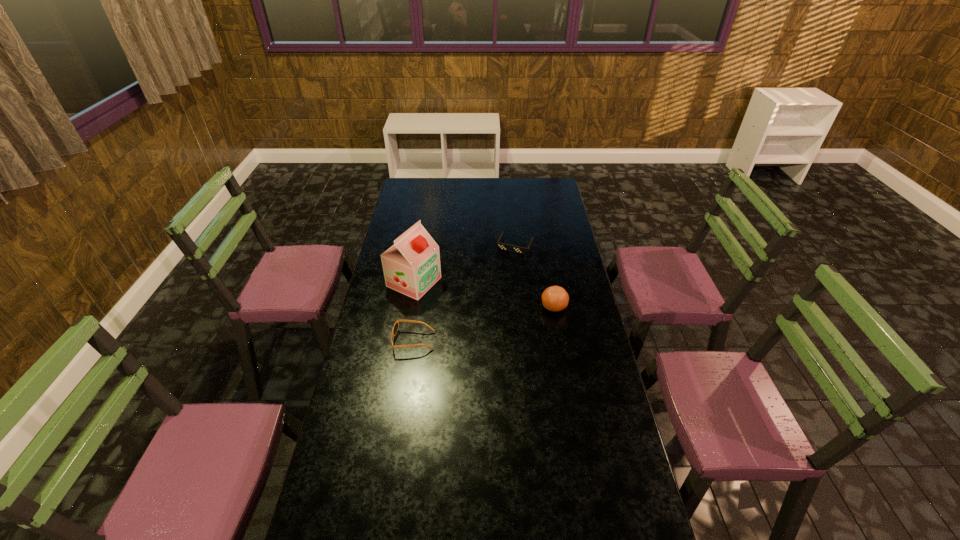
This screenshot has width=960, height=540. What are the coordinates of `vacant space at the near edge` in the screenshot? It's located at (416, 528).

In the image, there is a desktop. Where is `vacant area at the left edge`? The height and width of the screenshot is (540, 960). vacant area at the left edge is located at coordinates (341, 422).

In the image, there is a desktop. Identify the location of free space at the right edge. (564, 240).

Locate an element on the screen. The width and height of the screenshot is (960, 540). vacant space at the far right corner of the desktop is located at coordinates (551, 179).

At what (x,y) coordinates should I click in order to perform the action: click on empty location between the farther sunglasses and the tallest object. Please return your answer as a coordinate pair (x, y). Looking at the image, I should click on (465, 264).

Identify the location of empty space between the farther sunglasses and the third shortest object. (535, 276).

The height and width of the screenshot is (540, 960). I want to click on unoccupied area between the farthest object and the nearer sunglasses, so click(465, 293).

The image size is (960, 540). Find the location of `free space between the third shortest object and the soya milk`. free space between the third shortest object and the soya milk is located at coordinates pyautogui.click(x=484, y=294).

Locate an element on the screen. The image size is (960, 540). free space between the right sunglasses and the second tallest object is located at coordinates (535, 276).

Locate an element on the screen. This screenshot has height=540, width=960. vacant region between the nearer sunglasses and the tallest object is located at coordinates (414, 311).